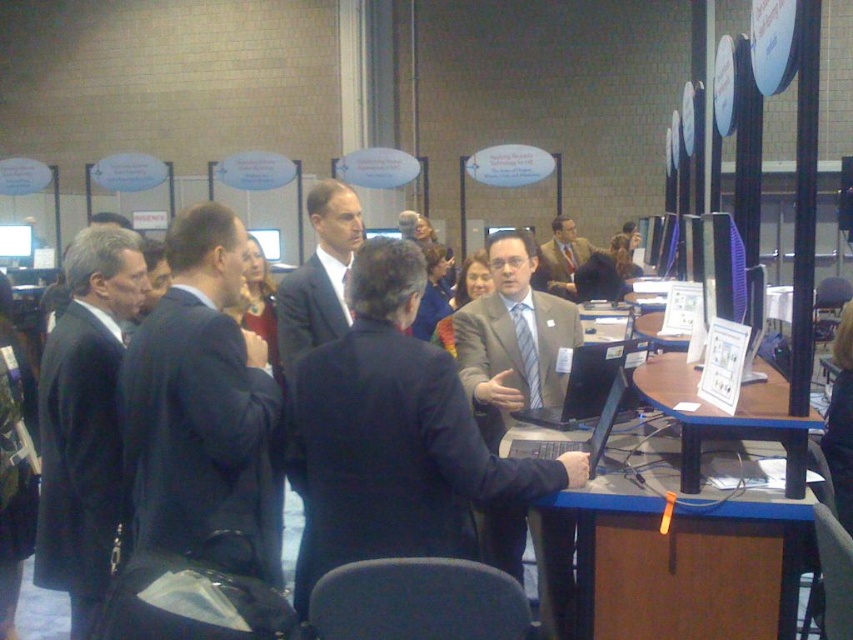
Question: Is dark blue suit at left wider than wooden table at center?

Choices:
 (A) no
 (B) yes

Answer: (A)

Question: Does dark blue suit at left appear on the right side of wooden table at center?

Choices:
 (A) no
 (B) yes

Answer: (A)

Question: Which object is positioned farthest from the wooden table at center?

Choices:
 (A) matte gray suit at center
 (B) gray suit at center
 (C) light brown suit at center
 (D) matte black laptop at center

Answer: (A)

Question: Which object is closer to the camera taking this photo?

Choices:
 (A) matte gray suit at center
 (B) wooden table at center
 (C) matte black suit at center
 (D) dark blue suit at left

Answer: (B)

Question: Estimate the real-world distances between objects in this image. Which object is farther from the gray suit at center?

Choices:
 (A) light brown suit at center
 (B) silver metallic laptop at center
 (C) matte black suit at center
 (D) dark blue suit at left

Answer: (D)

Question: Is gray suit at center positioned before silver metallic laptop at center?

Choices:
 (A) no
 (B) yes

Answer: (A)